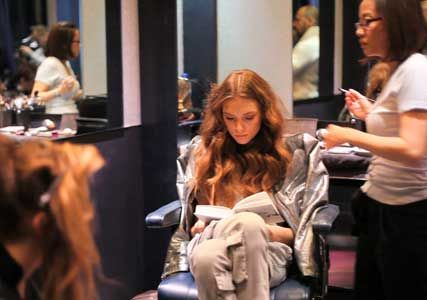
Locate an element on the screen. Image resolution: width=427 pixels, height=300 pixels. wall is located at coordinates (166, 131), (163, 53), (163, 185).